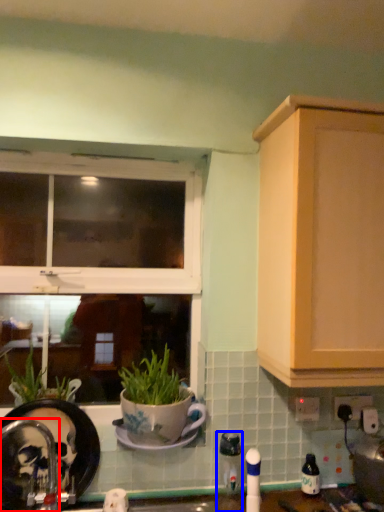
Question: Which object is closer to the camera taking this photo, faucet (highlighted by a red box) or appliance (highlighted by a blue box)?

Choices:
 (A) faucet
 (B) appliance

Answer: (A)